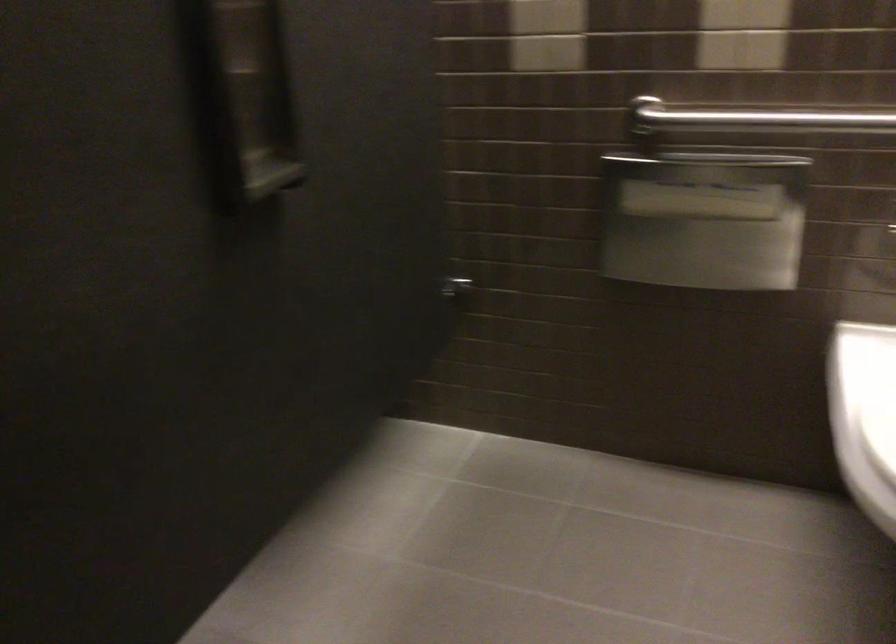
Locate an element on the screen. This screenshot has height=644, width=896. toilet paper dispenser is located at coordinates (x=703, y=220).